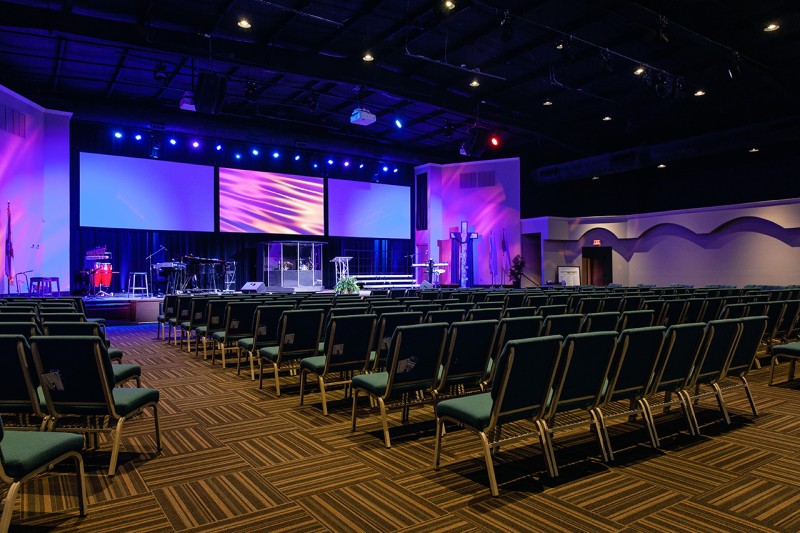
The width and height of the screenshot is (800, 533). In order to click on light in this screenshot , I will do `click(694, 92)`.